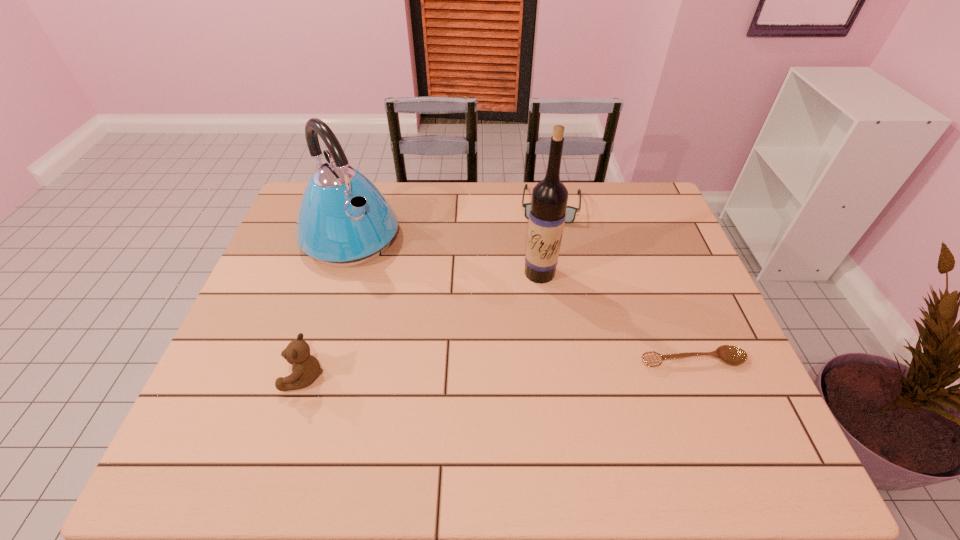
Find the location of a particular element. vacant space at the near left corner of the desktop is located at coordinates (216, 416).

You are a GUI agent. You are given a task and a screenshot of the screen. Output one action in this format:
    pyautogui.click(x=<x>, y=<y>)
    Task: Click on the vacant space at the near right corner of the desktop
    Image resolution: width=960 pixels, height=540 pixels.
    Given the screenshot: What is the action you would take?
    pyautogui.click(x=681, y=396)

What are the coordinates of `vacant area between the spectacles and the teddy bear` in the screenshot? It's located at (428, 290).

Locate an element on the screen. vacant space that's between the second shortest object and the ladle is located at coordinates (622, 282).

Image resolution: width=960 pixels, height=540 pixels. I want to click on vacant space that's between the kettle and the third shortest object, so click(327, 307).

Where is `blank region between the ladle and the spectacles`? blank region between the ladle and the spectacles is located at coordinates (622, 282).

Where is `vacant area that lies between the teddy bear and the second shortest object`? vacant area that lies between the teddy bear and the second shortest object is located at coordinates (428, 290).

You are a GUI agent. You are given a task and a screenshot of the screen. Output one action in this format:
    pyautogui.click(x=<x>, y=<y>)
    Task: Click on the vacant area that lies between the third shortest object and the fourth tallest object
    
    Given the screenshot: What is the action you would take?
    pyautogui.click(x=428, y=290)

The width and height of the screenshot is (960, 540). I want to click on free spot between the kettle and the wine bottle, so click(x=445, y=255).

The height and width of the screenshot is (540, 960). What are the coordinates of `empty space between the kettle and the rightmost object` in the screenshot? It's located at (521, 299).